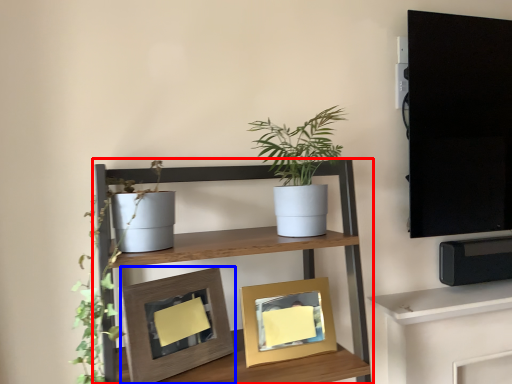
Question: Which of the following is the farthest to the observer, shelf (highlighted by a red box) or picture frame (highlighted by a blue box)?

Choices:
 (A) shelf
 (B) picture frame

Answer: (B)